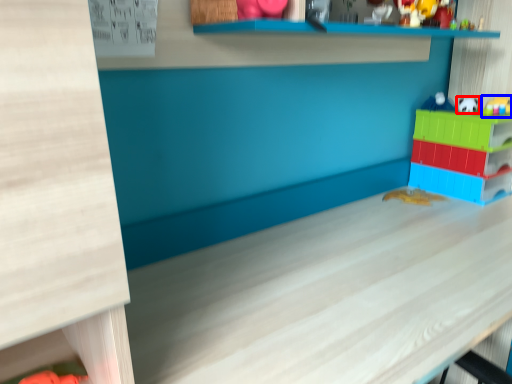
Question: Which object appears closest to the camera in this image, toy (highlighted by a red box) or toy (highlighted by a blue box)?

Choices:
 (A) toy
 (B) toy

Answer: (B)